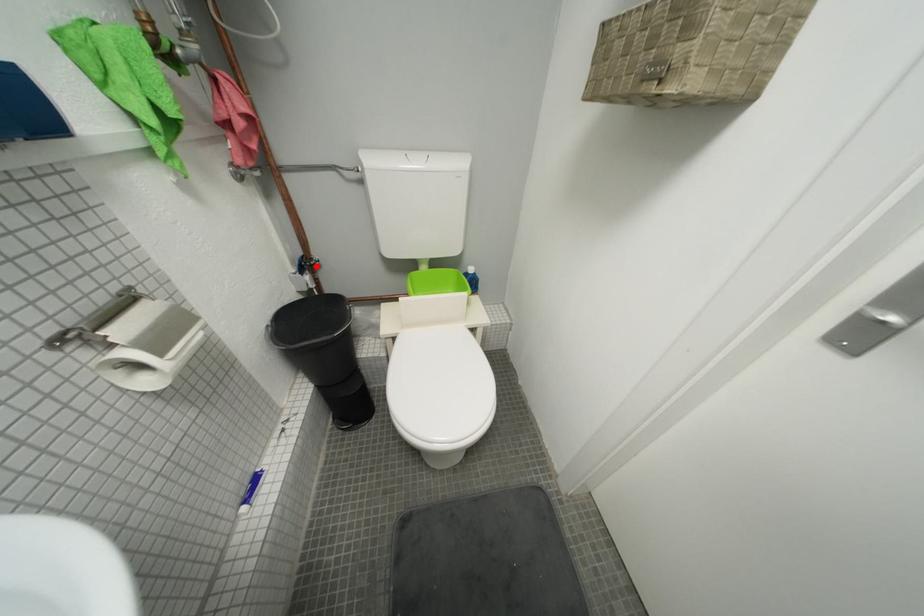
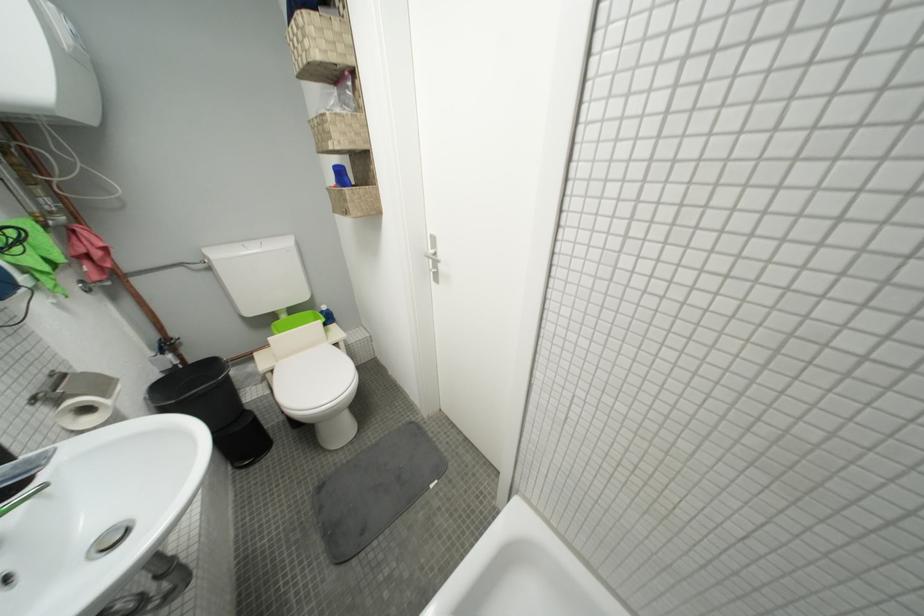
Find the pixel in the second image that matches the highlighted location in the first image.

(175, 347)